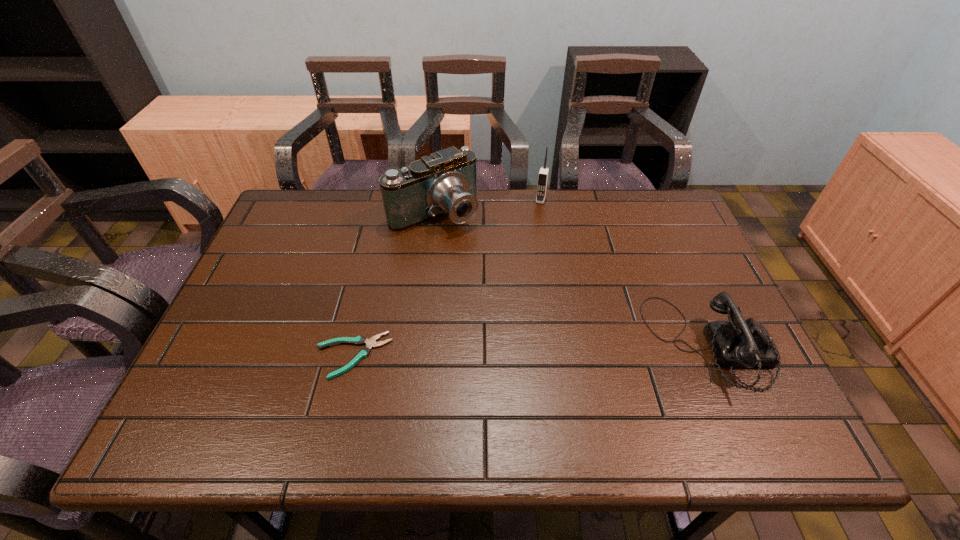
At what (x,y) coordinates should I click in order to perform the action: click on free space at the far left corner of the desktop. Please return your answer as a coordinate pair (x, y). The width and height of the screenshot is (960, 540). Looking at the image, I should click on (308, 221).

In the image, there is a desktop. Identify the location of vacant space at the near left corner. This screenshot has height=540, width=960. (225, 384).

The image size is (960, 540). Identify the location of vacant space at the far right corner of the desktop. (688, 230).

Locate an element on the screen. This screenshot has width=960, height=540. vacant space in between the second object from right to left and the rightmost object is located at coordinates (625, 272).

Locate an element on the screen. free spot between the rightmost object and the cellular telephone is located at coordinates (625, 272).

Find the location of `free space between the third object from left to right and the camcorder`. free space between the third object from left to right and the camcorder is located at coordinates click(x=488, y=206).

Find the location of a particular element. Image resolution: width=960 pixels, height=540 pixels. free area in between the shortest object and the camcorder is located at coordinates (394, 284).

Locate an element on the screen. This screenshot has height=540, width=960. unoccupied area between the telephone and the camcorder is located at coordinates (x=571, y=279).

What are the coordinates of `empty location between the rightmost object and the cellular telephone` in the screenshot? It's located at tap(625, 272).

The image size is (960, 540). Identify the location of vacant space in between the second shortest object and the pliers. (531, 350).